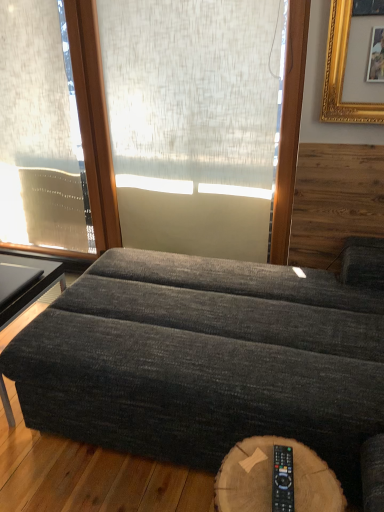
Question: From a real-world perspective, does white textured screen at center stand above dark gray fabric ottoman at lower left?

Choices:
 (A) no
 (B) yes

Answer: (B)

Question: Is white textured screen at center smaller than dark gray fabric ottoman at lower left?

Choices:
 (A) no
 (B) yes

Answer: (B)

Question: Considering the relative positions of white textured screen at center and dark gray fabric ottoman at lower left in the image provided, is white textured screen at center to the right of dark gray fabric ottoman at lower left from the viewer's perspective?

Choices:
 (A) yes
 (B) no

Answer: (A)

Question: From the image's perspective, would you say white textured screen at center is shown under dark gray fabric ottoman at lower left?

Choices:
 (A) yes
 (B) no

Answer: (B)

Question: Is white textured screen at center further to the viewer compared to dark gray fabric ottoman at lower left?

Choices:
 (A) no
 (B) yes

Answer: (B)

Question: Looking at their shapes, would you say dark gray fabric ottoman at lower left is wider or thinner than wooden log table at lower center?

Choices:
 (A) wide
 (B) thin

Answer: (A)

Question: From the image's perspective, is dark gray fabric ottoman at lower left located above or below wooden log table at lower center?

Choices:
 (A) above
 (B) below

Answer: (A)

Question: Is dark gray fabric ottoman at lower left to the left or to the right of wooden log table at lower center in the image?

Choices:
 (A) left
 (B) right

Answer: (A)

Question: Considering the positions of dark gray fabric ottoman at lower left and wooden log table at lower center in the image, is dark gray fabric ottoman at lower left bigger or smaller than wooden log table at lower center?

Choices:
 (A) big
 (B) small

Answer: (A)

Question: Which is correct: wooden log table at lower center is inside black plastic remote at lower right, or outside of it?

Choices:
 (A) inside
 (B) outside

Answer: (B)

Question: Considering their positions, is wooden log table at lower center located in front of or behind black plastic remote at lower right?

Choices:
 (A) front
 (B) behind

Answer: (A)

Question: Considering the positions of point (233, 458) and point (279, 464), is point (233, 458) closer or farther from the camera than point (279, 464)?

Choices:
 (A) closer
 (B) farther

Answer: (B)

Question: Is wooden log table at lower center taller or shorter than black plastic remote at lower right?

Choices:
 (A) short
 (B) tall

Answer: (B)

Question: Considering the positions of white textured screen at center and wooden log table at lower center in the image, is white textured screen at center wider or thinner than wooden log table at lower center?

Choices:
 (A) wide
 (B) thin

Answer: (B)

Question: From the image's perspective, is white textured screen at center positioned above or below wooden log table at lower center?

Choices:
 (A) above
 (B) below

Answer: (A)